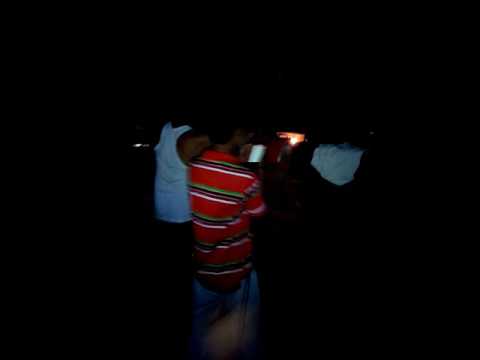
Locate an element on the screen. The image size is (480, 360). sheet is located at coordinates (326, 170).